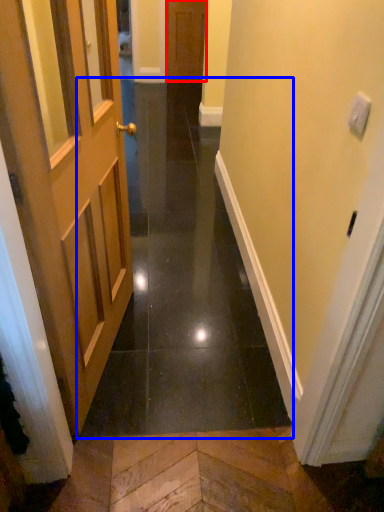
Question: Which of the following is the closest to the observer, door (highlighted by a red box) or path (highlighted by a blue box)?

Choices:
 (A) door
 (B) path

Answer: (B)